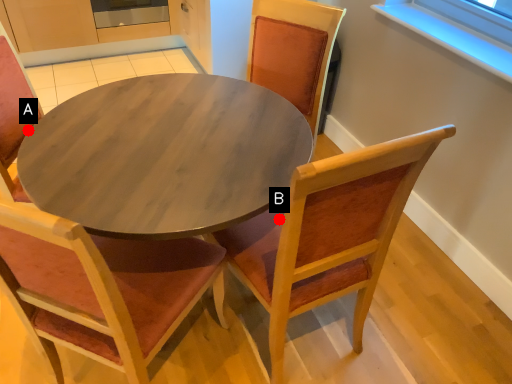
Question: Two points are circled on the image, labeled by A and B beside each circle. Which point is farther to the camera?

Choices:
 (A) A is further
 (B) B is further

Answer: (A)